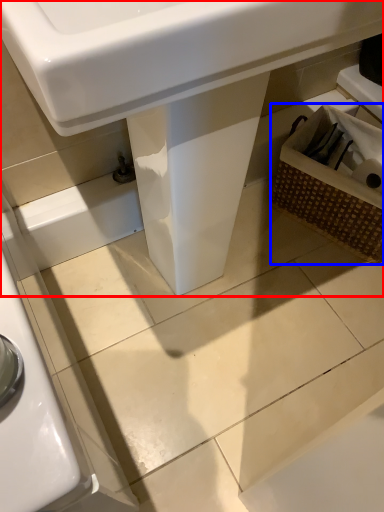
Question: Which point is closer to the camera, sink (highlighted by a red box) or basket (highlighted by a blue box)?

Choices:
 (A) sink
 (B) basket

Answer: (A)